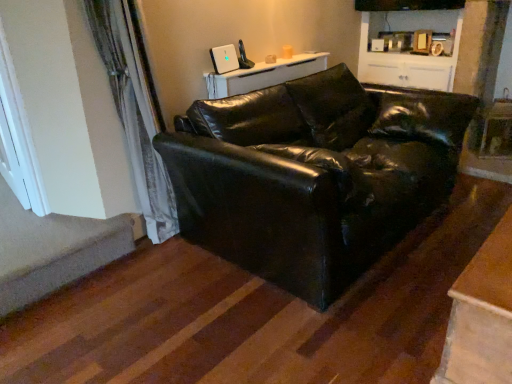
Question: From a real-world perspective, is white painted wood window at left physically located above or below black leather couch at center?

Choices:
 (A) below
 (B) above

Answer: (B)

Question: Considering the positions of point (8, 96) and point (346, 263), is point (8, 96) closer or farther from the camera than point (346, 263)?

Choices:
 (A) closer
 (B) farther

Answer: (B)

Question: Estimate the real-world distances between objects in this image. Which object is farther from the white glossy table at upper center, the 1th table when ordered from left to right?

Choices:
 (A) white painted wood window at left
 (B) carpeted stairwell at lower left
 (C) white glossy cabinet at upper center
 (D) velvet curtain at left
 (E) wooden table at lower right, which is the first table in front-to-back order

Answer: (E)

Question: Which object is the farthest from the black leather couch at center?

Choices:
 (A) white glossy table at upper center, the 1th table when ordered from left to right
 (B) velvet curtain at left
 (C) carpeted stairwell at lower left
 (D) white glossy cabinet at upper center
 (E) white painted wood window at left

Answer: (D)